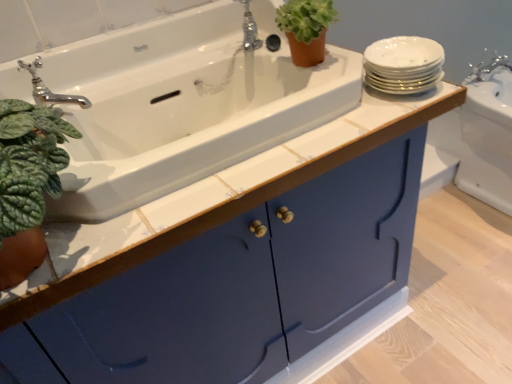
Question: In terms of width, does chrome metallic faucet at upper left, positioned as the first tap in bottom-to-top order, look wider or thinner when compared to white porcelain plates at upper right?

Choices:
 (A) wide
 (B) thin

Answer: (B)

Question: From the image's perspective, is chrome metallic faucet at upper left, marked as the second tap in a top-to-bottom arrangement, located above or below white porcelain plates at upper right?

Choices:
 (A) above
 (B) below

Answer: (B)

Question: Based on their relative distances, which object is nearer to the white porcelain plates at upper right?

Choices:
 (A) white glossy sink at upper right, the 2th sink from the front
 (B) matte blue cabinet at center
 (C) white ceramic sink at upper left, which ranks as the first sink in left-to-right order
 (D) polished chrome faucet at upper center, acting as the 2th tap starting from the bottom
 (E) chrome metallic faucet at upper left, the first tap in the front-to-back sequence

Answer: (C)

Question: Which of these objects is positioned closest to the polished chrome faucet at upper center, acting as the 2th tap starting from the bottom?

Choices:
 (A) white glossy sink at upper right, placed as the 1th sink when sorted from right to left
 (B) matte blue cabinet at center
 (C) white ceramic sink at upper left, the 2th sink when ordered from right to left
 (D) chrome metallic faucet at upper left, the 2th tap when ordered from back to front
 (E) white porcelain plates at upper right

Answer: (C)